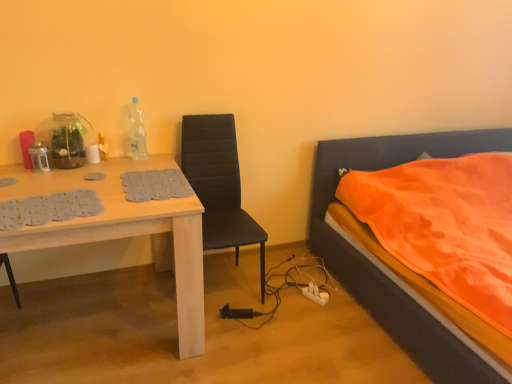
In order to click on blank area beneath black leather chair at center (from a real-world perspective) in this screenshot , I will do `click(231, 292)`.